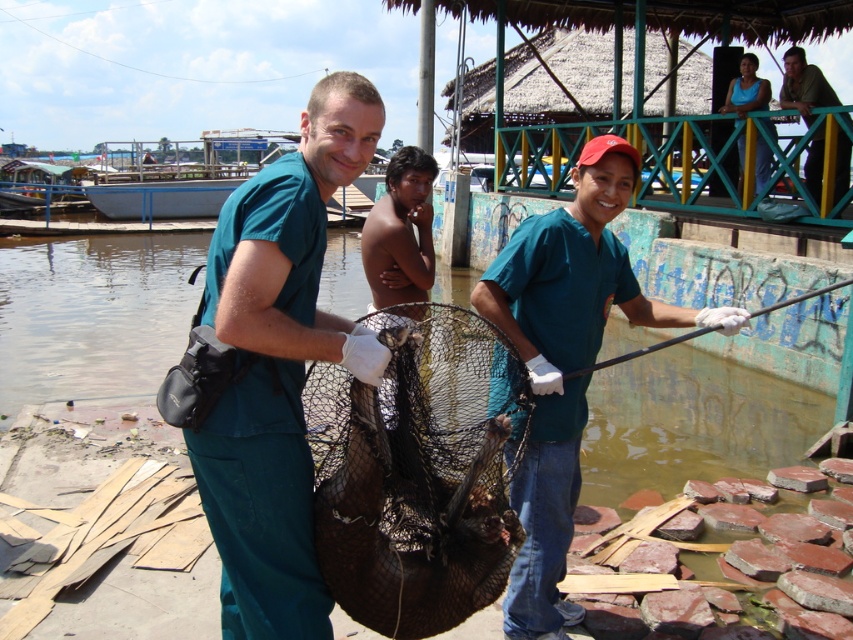
Question: Considering the relative positions of teal scrubs at center and green fabric shirt at upper right in the image provided, where is teal scrubs at center located with respect to green fabric shirt at upper right?

Choices:
 (A) above
 (B) below

Answer: (B)

Question: Does green matte shirt at center have a smaller size compared to dark skin/rough skin boy at center?

Choices:
 (A) no
 (B) yes

Answer: (A)

Question: In this image, where is clear water at center located relative to black mesh net at center?

Choices:
 (A) below
 (B) above

Answer: (B)

Question: Which of the following is the closest to the observer?

Choices:
 (A) black metal fishing pole at right
 (B) green matte shirt at center

Answer: (B)

Question: Which point is farther to the camera?

Choices:
 (A) (422, 284)
 (B) (793, 83)
 (C) (660, 348)

Answer: (B)

Question: Considering the real-world distances, which object is closest to the green fabric shirt at upper right?

Choices:
 (A) black mesh net at center
 (B) green matte shirt at center
 (C) black metal fishing pole at right

Answer: (B)